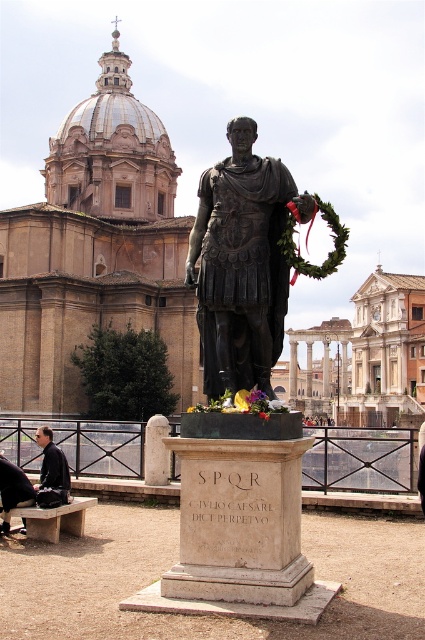
Is polished bronze statue at center to the right of dark blue jeans at lower left from the viewer's perspective?

Indeed, polished bronze statue at center is positioned on the right side of dark blue jeans at lower left.

Between polished bronze statue at center and dark blue jeans at lower left, which one has less height?

Standing shorter between the two is dark blue jeans at lower left.

Does point (252, 307) come closer to viewer compared to point (19, 476)?

Yes, it is in front of point (19, 476).

This screenshot has height=640, width=425. I want to click on polished bronze statue at center, so click(x=240, y=394).

Does polished bronze statue at center appear on the left side of bronze statue at center?

Indeed, polished bronze statue at center is positioned on the left side of bronze statue at center.

Can you confirm if polished bronze statue at center is thinner than bronze statue at center?

In fact, polished bronze statue at center might be wider than bronze statue at center.

Is point (189, 484) positioned after point (234, 200)?

No, it is not.

This screenshot has width=425, height=640. I want to click on polished bronze statue at center, so click(240, 394).

Can you confirm if bronze statue at center is bigger than dark blue jeans at lower left?

Yes, bronze statue at center is bigger than dark blue jeans at lower left.

Is bronze statue at center shorter than dark blue jeans at lower left?

Incorrect, bronze statue at center's height does not fall short of dark blue jeans at lower left's.

In order to click on bronze statue at center in this screenshot , I will do `click(241, 262)`.